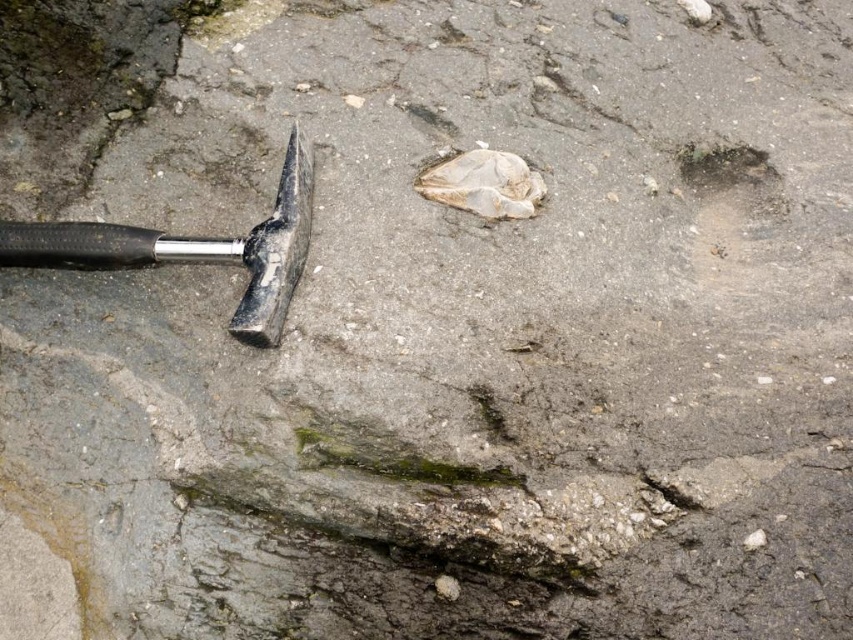
Which of these two, matte black hammer at left or smooth gray hole at upper right, stands taller?

matte black hammer at left

Is point (91, 252) behind point (718, 147)?

No, it is not.

The width and height of the screenshot is (853, 640). I want to click on matte black hammer at left, so click(193, 248).